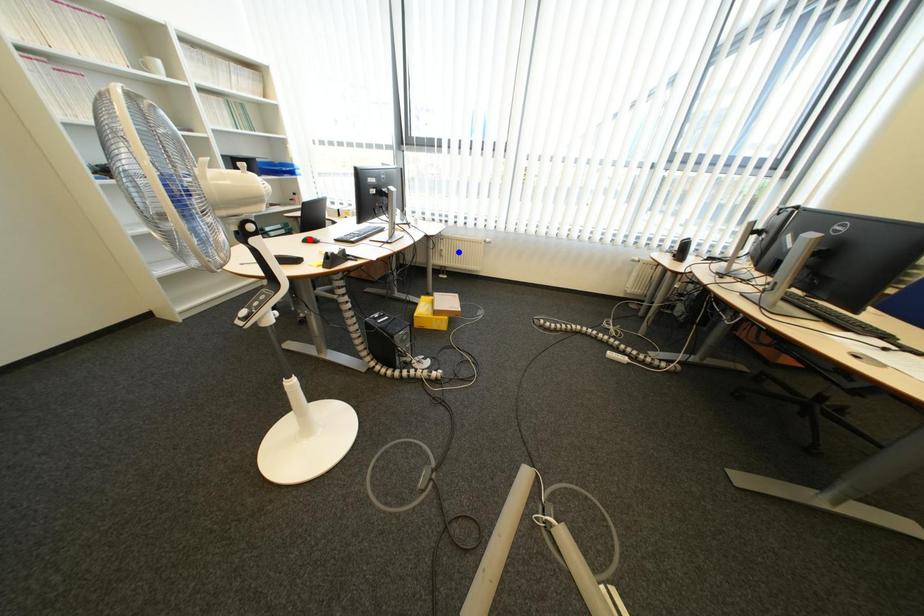
Question: Two points are marked on the image. Which point is closer to the camera?

Choices:
 (A) Blue point is closer.
 (B) Red point is closer.

Answer: (B)